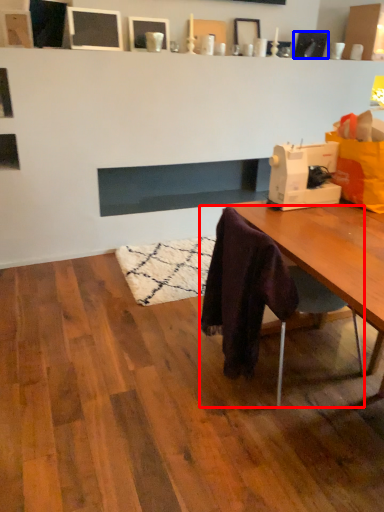
Question: Which object appears closest to the camera in this image, chair (highlighted by a red box) or picture frame (highlighted by a blue box)?

Choices:
 (A) chair
 (B) picture frame

Answer: (A)